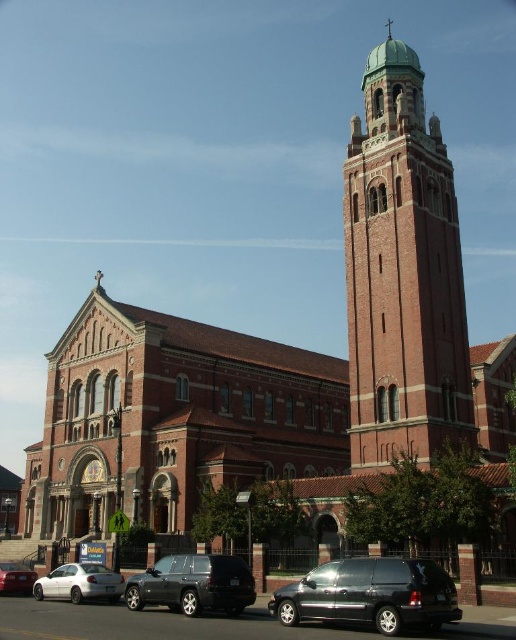
Question: Does shiny black minivan at lower center appear on the right side of shiny black suv at lower left?

Choices:
 (A) no
 (B) yes

Answer: (B)

Question: Considering the relative positions of shiny black minivan at lower center and shiny black suv at lower left in the image provided, where is shiny black minivan at lower center located with respect to shiny black suv at lower left?

Choices:
 (A) left
 (B) right

Answer: (B)

Question: Is shiny black minivan at lower center positioned behind shiny black suv at lower left?

Choices:
 (A) no
 (B) yes

Answer: (A)

Question: Which point is farther to the camera?

Choices:
 (A) green copper tower at upper center
 (B) shiny black minivan at lower center

Answer: (A)

Question: Among these objects, which one is farthest from the camera?

Choices:
 (A) shiny black suv at lower left
 (B) white matte sedan at lower left
 (C) matte white sedan at lower left
 (D) shiny black minivan at lower center

Answer: (C)

Question: Which is farther from the green copper tower at upper center?

Choices:
 (A) white matte sedan at lower left
 (B) matte white sedan at lower left

Answer: (B)